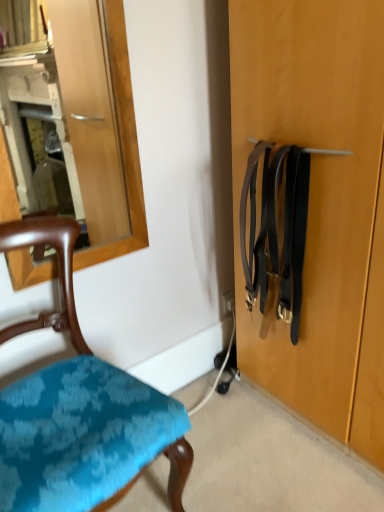
Question: Considering the relative positions of black leather suspenders at right and teal fabric chair at lower left in the image provided, is black leather suspenders at right to the left or to the right of teal fabric chair at lower left?

Choices:
 (A) right
 (B) left

Answer: (A)

Question: Considering the positions of black leather suspenders at right and teal fabric chair at lower left in the image, is black leather suspenders at right taller or shorter than teal fabric chair at lower left?

Choices:
 (A) short
 (B) tall

Answer: (A)

Question: Is black leather suspenders at right situated inside teal fabric chair at lower left or outside?

Choices:
 (A) outside
 (B) inside

Answer: (A)

Question: In terms of height, does teal fabric chair at lower left look taller or shorter compared to black leather suspenders at right?

Choices:
 (A) short
 (B) tall

Answer: (B)

Question: Is teal fabric chair at lower left wider or thinner than black leather suspenders at right?

Choices:
 (A) wide
 (B) thin

Answer: (A)

Question: Is teal fabric chair at lower left inside the boundaries of black leather suspenders at right, or outside?

Choices:
 (A) outside
 (B) inside

Answer: (A)

Question: Considering their positions, is teal fabric chair at lower left located in front of or behind black leather suspenders at right?

Choices:
 (A) behind
 (B) front

Answer: (B)